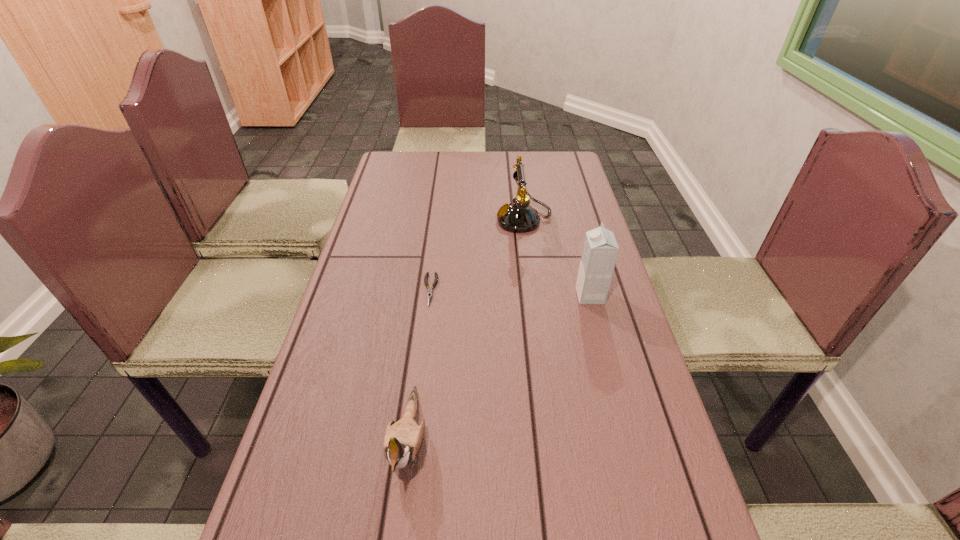
Where is `vacant space that is in between the carton and the pliers`? vacant space that is in between the carton and the pliers is located at coordinates (510, 293).

At what (x,y) coordinates should I click in order to perform the action: click on free point between the carton and the pliers. Please return your answer as a coordinate pair (x, y). Looking at the image, I should click on (510, 293).

This screenshot has height=540, width=960. I want to click on blank region between the farthest object and the nearest object, so click(x=467, y=330).

Identify the location of unoccupied area between the pliers and the rightmost object. (510, 293).

Locate an element on the screen. The height and width of the screenshot is (540, 960). free space between the telephone and the nearest object is located at coordinates (467, 330).

Identify the location of vacant point located between the shortest object and the carton. Image resolution: width=960 pixels, height=540 pixels. (510, 293).

This screenshot has width=960, height=540. I want to click on free area in between the telephone and the shortest object, so click(477, 254).

Where is `free point between the pliers and the rightmost object`? free point between the pliers and the rightmost object is located at coordinates click(x=510, y=293).

Identify the location of unoccupied position between the rightmost object and the farthest object. (557, 258).

The width and height of the screenshot is (960, 540). I want to click on vacant space that's between the carton and the farthest object, so click(557, 258).